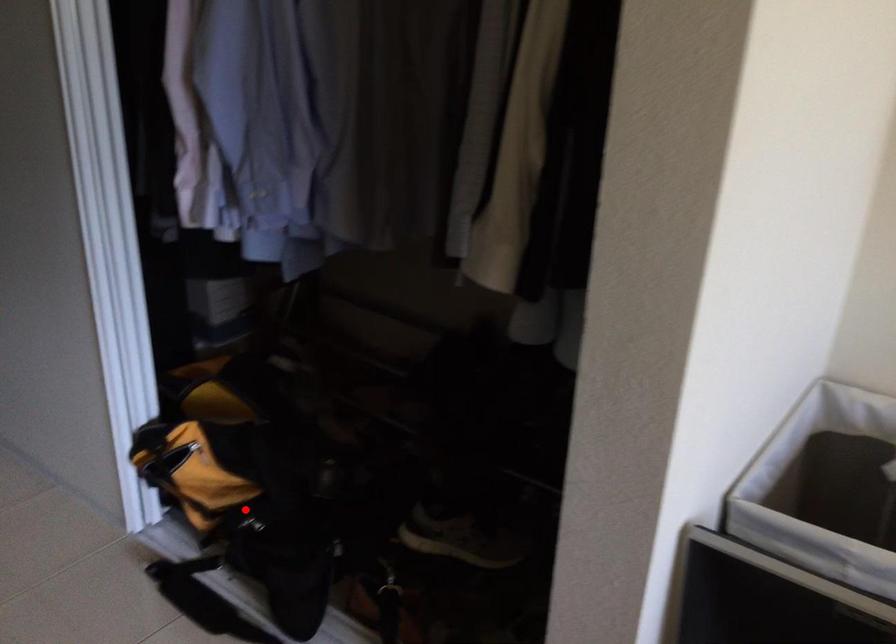
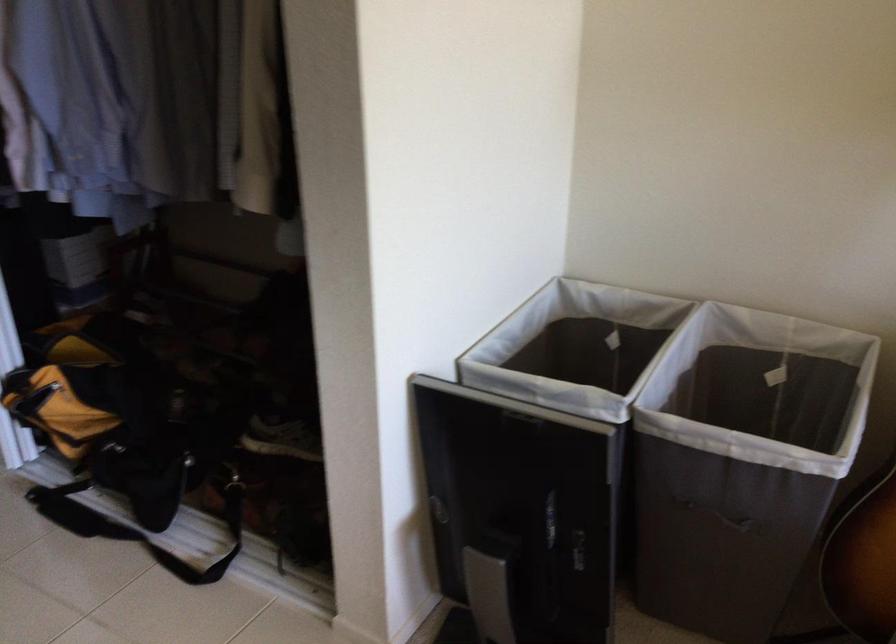
Question: I am providing you with two images of the same scene from different viewpoints. Given a red point in image1, look at the same physical point in image2. Is it:

Choices:
 (A) Closer to the viewpoint
 (B) Farther from the viewpoint

Answer: (B)